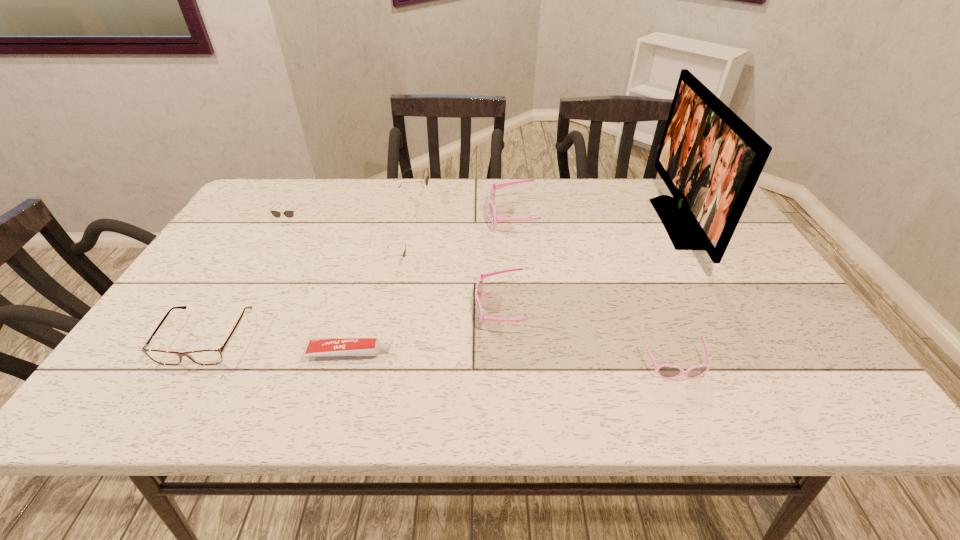
Locate an element on the screen. the rightmost object is located at coordinates (710, 160).

Where is `the tallest object`? Image resolution: width=960 pixels, height=540 pixels. the tallest object is located at coordinates (710, 160).

I want to click on the farthest black sunglasses, so click(x=426, y=181).

You are a GUI agent. You are given a task and a screenshot of the screen. Output one action in this format:
    pyautogui.click(x=<x>, y=<y>)
    Task: Click on the eighth shortest object
    The width and height of the screenshot is (960, 540).
    Given the screenshot: What is the action you would take?
    pyautogui.click(x=426, y=181)

The width and height of the screenshot is (960, 540). In order to click on the biggest pink sunglasses in this screenshot , I will do `click(491, 199)`.

At what (x,y) coordinates should I click in order to perform the action: click on the second nearest black sunglasses. Please return your answer as a coordinate pair (x, y). Image resolution: width=960 pixels, height=540 pixels. Looking at the image, I should click on (289, 213).

This screenshot has width=960, height=540. Identify the location of the leftmost black sunglasses. (289, 213).

Where is `the second nearest sunglasses`? The height and width of the screenshot is (540, 960). the second nearest sunglasses is located at coordinates (479, 287).

Identify the location of the second farthest pink sunglasses. (479, 287).

In order to click on the smallest black sunglasses in this screenshot , I will do `click(404, 253)`.